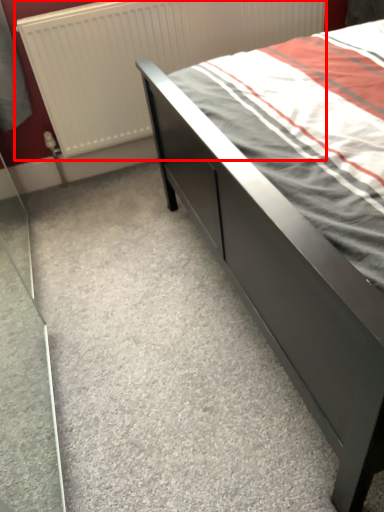
Question: Considering the relative positions of radiator (annotated by the red box) and bed in the image provided, where is radiator (annotated by the red box) located with respect to the staircase?

Choices:
 (A) right
 (B) left

Answer: (A)